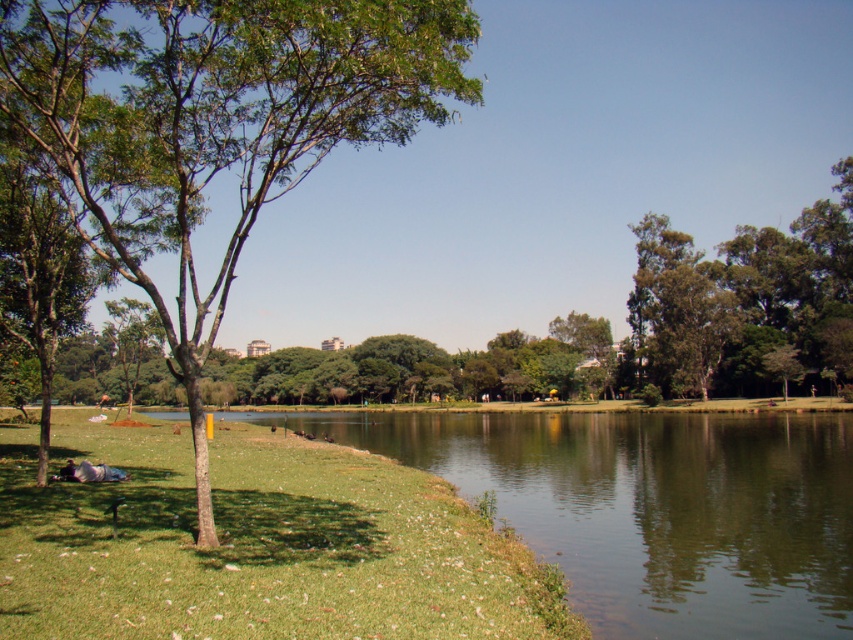
Question: Can you confirm if green leafy tree at left is positioned above green leafy tree at upper right?

Choices:
 (A) yes
 (B) no

Answer: (A)

Question: Among these points, which one is farthest from the camera?

Choices:
 (A) (143, 116)
 (B) (741, 381)

Answer: (B)

Question: Does green grassy at lower left appear on the right side of green leafy tree at left?

Choices:
 (A) no
 (B) yes

Answer: (B)

Question: Which point is farther to the camera?

Choices:
 (A) pyautogui.click(x=643, y=304)
 (B) pyautogui.click(x=457, y=54)
 (C) pyautogui.click(x=84, y=589)

Answer: (A)

Question: Is green leafy tree at left positioned in front of green leafy tree at upper right?

Choices:
 (A) yes
 (B) no

Answer: (A)

Question: Which point is farther to the camera?

Choices:
 (A) green leafy tree at upper right
 (B) green grassy at lower left
 (C) green leafy tree at left

Answer: (A)